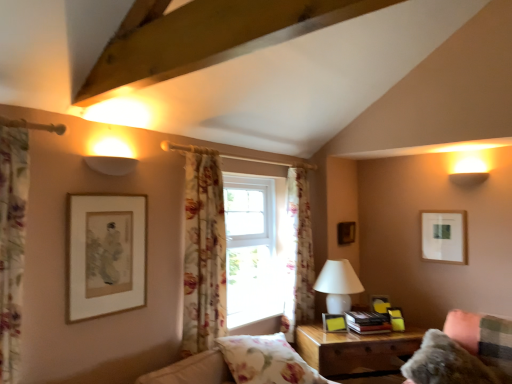
Image resolution: width=512 pixels, height=384 pixels. Describe the element at coordinates (203, 251) in the screenshot. I see `floral fabric curtain at center, placed as the second curtain when sorted from front to back` at that location.

I want to click on fuzzy fabric couch at lower right, so click(x=466, y=351).

In order to face floral fabric curtain at left, the first curtain viewed from the left, should I rotate leftwards or rightwards?

To align with it, rotate left about 30.112°.

Image resolution: width=512 pixels, height=384 pixels. What are the coordinates of `wooden nightstand at lower right` in the screenshot? It's located at (355, 350).

This screenshot has height=384, width=512. What do you see at coordinates (355, 350) in the screenshot? I see `wooden nightstand at lower right` at bounding box center [355, 350].

This screenshot has height=384, width=512. What do you see at coordinates (380, 303) in the screenshot?
I see `matte black picture frame at right, the fourth picture frame when ordered from left to right` at bounding box center [380, 303].

At what (x,y) coordinates should I click in order to perform the action: click on floral fabric pillow at lower center. Please return your answer as a coordinate pair (x, y). The height and width of the screenshot is (384, 512). Looking at the image, I should click on (266, 361).

In order to click on floral fabric curtain at center, the second curtain when ordered from back to front in this screenshot , I will do `click(203, 251)`.

From the image's perspective, is floral fabric curtain at left, which is counted as the 1th curtain, starting from the front, above or below wooden nightstand at lower right?

Based on their image positions, floral fabric curtain at left, which is counted as the 1th curtain, starting from the front, is located above wooden nightstand at lower right.

Between floral fabric curtain at left, the third curtain viewed from the right, and wooden nightstand at lower right, which one has less height?

wooden nightstand at lower right is shorter.

Is floral fabric curtain at left, which is counted as the 1th curtain, starting from the front, bigger or smaller than wooden nightstand at lower right?

Considering their sizes, floral fabric curtain at left, which is counted as the 1th curtain, starting from the front, takes up less space than wooden nightstand at lower right.

Locate an element on the screen. curtain that is the 3rd one when counting leftward from the wooden nightstand at lower right is located at coordinates (12, 243).

Which object is positioned more to the left, floral fabric pillow at lower center or floral fabric curtain at center, which appears as the second curtain when viewed from the right?

From the viewer's perspective, floral fabric curtain at center, which appears as the second curtain when viewed from the right, appears more on the left side.

In the scene shown: From a real-world perspective, who is located lower, floral fabric pillow at lower center or floral fabric curtain at center, placed as the second curtain when sorted from front to back?

From a 3D spatial view, floral fabric pillow at lower center is below.

Is floral fabric curtain at center, the second curtain when ordered from back to front, inside floral fabric pillow at lower center?

Actually, floral fabric curtain at center, the second curtain when ordered from back to front, is outside floral fabric pillow at lower center.

Is floral fabric pillow at lower center thinner than floral fabric curtain at center, placed as the second curtain when sorted from front to back?

In fact, floral fabric pillow at lower center might be wider than floral fabric curtain at center, placed as the second curtain when sorted from front to back.

Looking at this image, between white matte picture frame at upper right, the first picture frame in the right-to-left sequence, and white wooden window at center, which one is positioned behind?

white matte picture frame at upper right, the first picture frame in the right-to-left sequence, is further from the camera.

Can you confirm if white matte picture frame at upper right, which is the second picture frame in back-to-front order, is shorter than white wooden window at center?

Yes, white matte picture frame at upper right, which is the second picture frame in back-to-front order, is shorter than white wooden window at center.

Consider the image. From the image's perspective, does white matte picture frame at upper right, which appears as the fifth picture frame when viewed from the front, appear higher than white wooden window at center?

Yes, from the image's perspective, white matte picture frame at upper right, which appears as the fifth picture frame when viewed from the front, is over white wooden window at center.

Is white matte picture frame at upper right, which appears as the fifth picture frame when viewed from the front, inside or outside of white wooden window at center?

white matte picture frame at upper right, which appears as the fifth picture frame when viewed from the front, is located beyond the bounds of white wooden window at center.

I want to click on window behind the matte yellow picture frame at right, which is the second picture frame from front to back, so 254,247.

How many degrees apart are the facing directions of white wooden window at center and matte yellow picture frame at right, which is the second picture frame from front to back?

44.5 degrees.

Is point (270, 309) closer or farther from the camera than point (327, 317)?

Point (270, 309).

From the picture: Is white wooden window at center not within matte yellow picture frame at right, positioned as the 2th picture frame in left-to-right order?

Indeed, white wooden window at center is completely outside matte yellow picture frame at right, positioned as the 2th picture frame in left-to-right order.

From a real-world perspective, which object rests below the other?

matte gold picture frame at lower right, which appears as the third picture frame when viewed from the front, from a real-world perspective.

Does point (395, 321) come closer to viewer compared to point (132, 217)?

No.

In the scene shown: Is matte gold picture frame at lower right, acting as the 5th picture frame starting from the left, positioned with its back to matte gold picture frame at left, placed as the first picture frame when sorted from front to back?

matte gold picture frame at lower right, acting as the 5th picture frame starting from the left, does not have its back to matte gold picture frame at left, placed as the first picture frame when sorted from front to back.

How different are the orientations of matte gold picture frame at lower right, which appears as the third picture frame when viewed from the front, and matte gold picture frame at left, which is counted as the 6th picture frame, starting from the right, in degrees?

The facing directions of matte gold picture frame at lower right, which appears as the third picture frame when viewed from the front, and matte gold picture frame at left, which is counted as the 6th picture frame, starting from the right, are 48 degrees apart.

Is white matte picture frame at upper right, which is the second picture frame in back-to-front order, inside or outside of wooden picture frame at upper right, the third picture frame from the left?

white matte picture frame at upper right, which is the second picture frame in back-to-front order, cannot be found inside wooden picture frame at upper right, the third picture frame from the left.

How different are the orientations of white matte picture frame at upper right, which appears as the fifth picture frame when viewed from the front, and wooden picture frame at upper right, the sixth picture frame positioned from the front, in degrees?

The angular difference between white matte picture frame at upper right, which appears as the fifth picture frame when viewed from the front, and wooden picture frame at upper right, the sixth picture frame positioned from the front, is 95.2 degrees.

From the image's perspective, relative to wooden picture frame at upper right, positioned as the 1th picture frame in back-to-front order, is white matte picture frame at upper right, which appears as the fifth picture frame when viewed from the front, above or below?

white matte picture frame at upper right, which appears as the fifth picture frame when viewed from the front, is situated higher than wooden picture frame at upper right, positioned as the 1th picture frame in back-to-front order, in the image.

From a real-world perspective, is white matte picture frame at upper right, which is the second picture frame in back-to-front order, physically above wooden picture frame at upper right, the sixth picture frame positioned from the front?

No, from a real-world perspective, white matte picture frame at upper right, which is the second picture frame in back-to-front order, is not above wooden picture frame at upper right, the sixth picture frame positioned from the front.

Is white matte picture frame at upper right, which appears as the fifth picture frame when viewed from the front, located within wooden picture frame at upper right, positioned as the 1th picture frame in back-to-front order?

That's incorrect, white matte picture frame at upper right, which appears as the fifth picture frame when viewed from the front, is not inside wooden picture frame at upper right, positioned as the 1th picture frame in back-to-front order.

From a real-world perspective, who is located lower, wooden picture frame at upper right, positioned as the 1th picture frame in back-to-front order, or white matte picture frame at upper right, the first picture frame in the right-to-left sequence?

In real-world perspective, white matte picture frame at upper right, the first picture frame in the right-to-left sequence, is lower.

Can you confirm if wooden picture frame at upper right, the third picture frame from the left, is positioned to the right of white matte picture frame at upper right, the first picture frame in the right-to-left sequence?

In fact, wooden picture frame at upper right, the third picture frame from the left, is to the left of white matte picture frame at upper right, the first picture frame in the right-to-left sequence.

Identify the location of nightstand located behind the floral fabric curtain at left, the third curtain viewed from the right. Image resolution: width=512 pixels, height=384 pixels. (355, 350).

I want to click on the 2nd curtain above the floral fabric pillow at lower center (from the image's perspective), so click(203, 251).

Which object lies nearer to the anchor point white matte picture frame at upper right, the sixth picture frame positioned from the left, floral fabric curtain at left, the first curtain viewed from the left, or floral fabric curtain at center, which is the first curtain from right to left?

Based on the image, floral fabric curtain at center, which is the first curtain from right to left, appears to be nearer to white matte picture frame at upper right, the sixth picture frame positioned from the left.

Looking at the image, which one is located closer to wooden picture frame at upper right, the sixth picture frame positioned from the front, white glossy table lamp at center right or matte black picture frame at right, which ranks as the 4th picture frame in front-to-back order?

Based on the image, white glossy table lamp at center right appears to be nearer to wooden picture frame at upper right, the sixth picture frame positioned from the front.

When comparing their distances from matte yellow picture frame at right, which is counted as the fifth picture frame, starting from the right, does matte black picture frame at right, which ranks as the 4th picture frame in front-to-back order, or floral fabric curtain at center, which is counted as the third curtain, starting from the left, seem closer?

Among the two, matte black picture frame at right, which ranks as the 4th picture frame in front-to-back order, is located nearer to matte yellow picture frame at right, which is counted as the fifth picture frame, starting from the right.

Considering their positions, is white wooden window at center positioned closer to fuzzy fabric couch at lower right than matte gold picture frame at lower right, acting as the 5th picture frame starting from the left?

The object closer to fuzzy fabric couch at lower right is matte gold picture frame at lower right, acting as the 5th picture frame starting from the left.

In the scene shown: Based on their spatial positions, is matte yellow picture frame at right, the fifth picture frame viewed from the back, or floral fabric pillow at lower center closer to fuzzy fabric couch at lower right?

matte yellow picture frame at right, the fifth picture frame viewed from the back, is positioned closer to the anchor fuzzy fabric couch at lower right.

Estimate the real-world distances between objects in this image. Which object is further from matte gold picture frame at lower right, the second picture frame in the right-to-left sequence, floral fabric curtain at left, which is counted as the 1th curtain, starting from the front, or wooden nightstand at lower right?

Among the two, floral fabric curtain at left, which is counted as the 1th curtain, starting from the front, is located further to matte gold picture frame at lower right, the second picture frame in the right-to-left sequence.

Looking at the image, which one is located further to floral fabric pillow at lower center, matte gold picture frame at lower right, marked as the 4th picture frame in a back-to-front arrangement, or fuzzy fabric couch at lower right?

matte gold picture frame at lower right, marked as the 4th picture frame in a back-to-front arrangement, lies further to floral fabric pillow at lower center than the other object.

Looking at the image, which one is located further to wooden nightstand at lower right, floral fabric curtain at left, the third curtain viewed from the back, or fuzzy fabric couch at lower right?

floral fabric curtain at left, the third curtain viewed from the back, lies further to wooden nightstand at lower right than the other object.

Identify the location of table lamp situated between matte yellow picture frame at right, which is the second picture frame from front to back, and matte gold picture frame at lower right, the second picture frame in the right-to-left sequence, from left to right. Image resolution: width=512 pixels, height=384 pixels. (338, 285).

Identify the location of table lamp between white wooden window at center and matte gold picture frame at lower right, marked as the 4th picture frame in a back-to-front arrangement, from left to right. (338, 285).

The width and height of the screenshot is (512, 384). In order to click on table lamp located between floral fabric curtain at left, which is counted as the 1th curtain, starting from the front, and wooden nightstand at lower right in the left-right direction in this screenshot , I will do `click(338, 285)`.

The height and width of the screenshot is (384, 512). Identify the location of window located between matte gold picture frame at left, placed as the first picture frame when sorted from front to back, and matte gold picture frame at lower right, which appears as the third picture frame when viewed from the front, in the left-right direction. (254, 247).